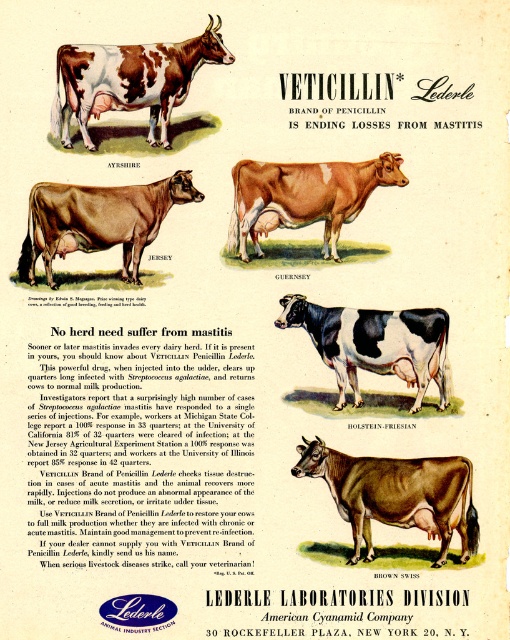
You are standing in front of the Veticillin advertisement. There are two points marked on the image. Which point is closer to you, point (170, 96) or point (403, 180)?

Point (170, 96) is closer to you than point (403, 180).

Based on the scene description, what is located at the coordinates point [396,493]?

The point [396,493] is occupied by a brown glossy holstein friesian at center.